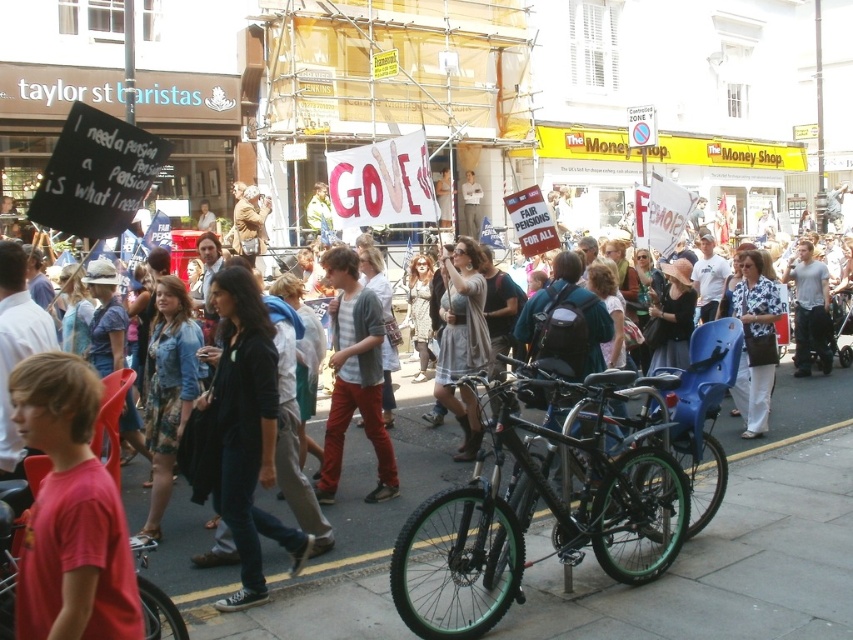
Question: Which is farther from the white cotton dress at center?

Choices:
 (A) green matte bicycle at center
 (B) striped cotton shirt at center
 (C) green matte bicycle at lower left

Answer: (C)

Question: Does green matte bicycle at center lie in front of green matte bicycle at lower left?

Choices:
 (A) no
 (B) yes

Answer: (A)

Question: Estimate the real-world distances between objects in this image. Which object is closer to the white cotton dress at center?

Choices:
 (A) light gray dress at center
 (B) striped cotton shirt at center
 (C) green matte bicycle at center

Answer: (A)

Question: Does red matte shirt at lower left lie in front of green matte bicycle at lower left?

Choices:
 (A) no
 (B) yes

Answer: (B)

Question: Among these objects, which one is nearest to the camera?

Choices:
 (A) green matte bicycle at lower left
 (B) striped cotton shirt at center
 (C) white cotton dress at center
 (D) red matte shirt at lower left

Answer: (D)

Question: Does red matte shirt at lower left have a smaller size compared to green matte bicycle at lower left?

Choices:
 (A) yes
 (B) no

Answer: (B)